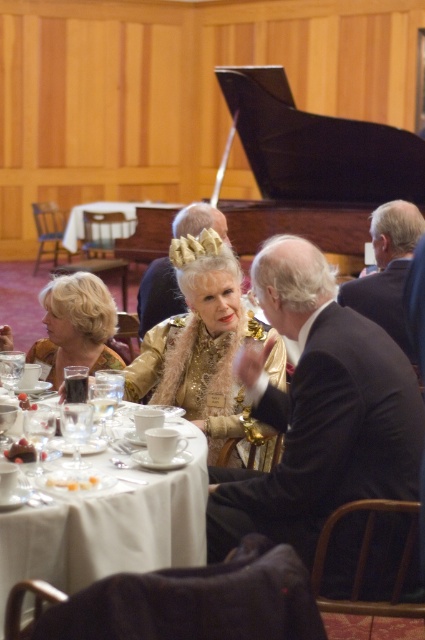
Is dark suit at center positioned behind dark suit at right?

No.

Can you confirm if dark suit at center is bigger than dark suit at right?

Yes, dark suit at center is bigger than dark suit at right.

Does point (312, 548) come behind point (413, 240)?

That is False.

You are a GUI agent. You are given a task and a screenshot of the screen. Output one action in this format:
    pyautogui.click(x=<x>, y=<y>)
    Task: Click on the dark suit at center
    
    Given the screenshot: What is the action you would take?
    pyautogui.click(x=317, y=412)

Is blonde hair at center to the left of chocolate cake at table center from the viewer's perspective?

Indeed, blonde hair at center is positioned on the left side of chocolate cake at table center.

Does blonde hair at center have a lesser width compared to chocolate cake at table center?

In fact, blonde hair at center might be wider than chocolate cake at table center.

Locate an element on the screen. blonde hair at center is located at coordinates (76, 326).

Is smooth white cream at lower left wider than chocolate cake at table center?

Correct, the width of smooth white cream at lower left exceeds that of chocolate cake at table center.

Who is more forward, (76, 481) or (28, 452)?

Positioned in front is point (76, 481).

Image resolution: width=425 pixels, height=640 pixels. I want to click on smooth white cream at lower left, so click(x=73, y=483).